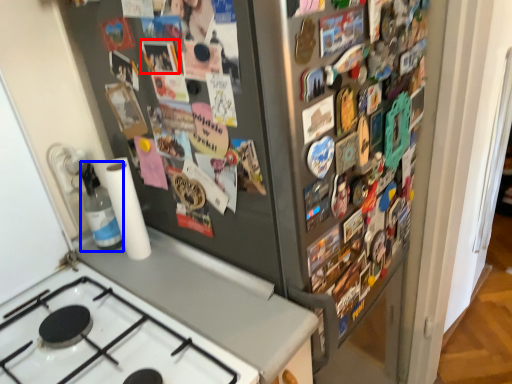
Question: Which object appears closest to the camera in this image, button (highlighted by a red box) or bottle (highlighted by a blue box)?

Choices:
 (A) button
 (B) bottle

Answer: (A)